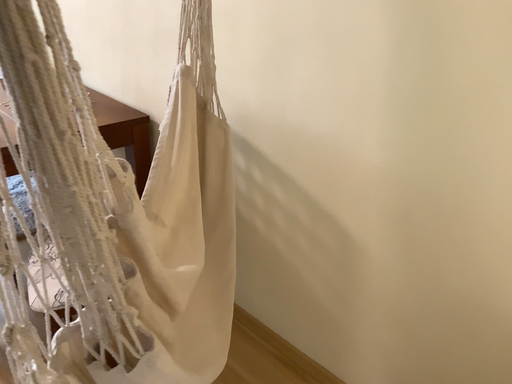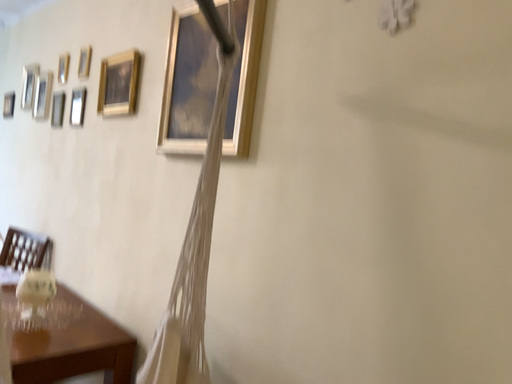
Question: Which way did the camera rotate in the video?

Choices:
 (A) rotated downward
 (B) rotated upward

Answer: (B)